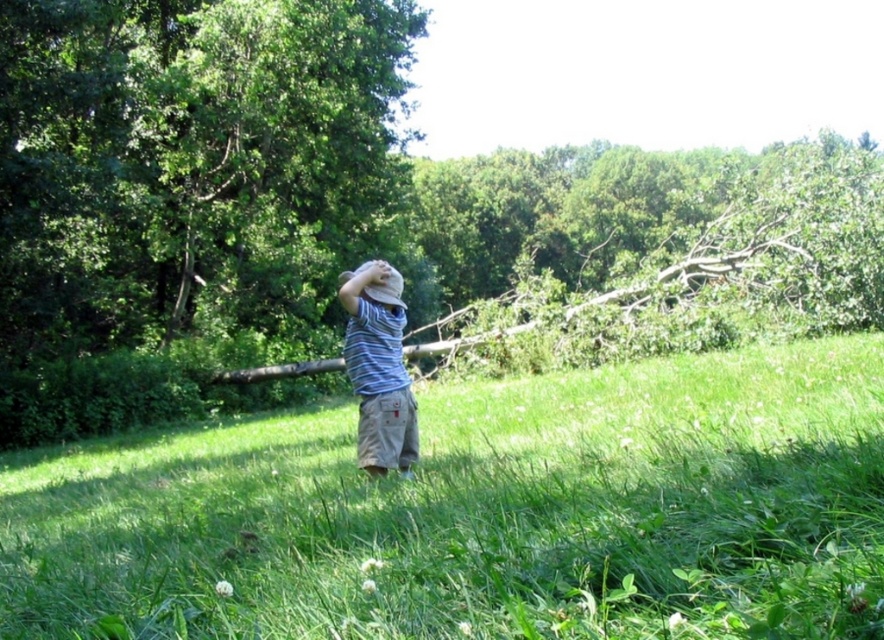
You are standing in the grassy field and want to place a picnic basket on the brown wood log at center. To do this, you need to walk towards the log. In which direction should you move relative to your current position?

The brown wood log at center is located at coordinates point (256, 196), so you should move towards that direction to place the picnic basket on it.

Consider the image. You are standing in the grassy field and want to place your backpack on the ground. You see the brown wood log at center and the striped cotton shirt at center. Which object is higher up and should you avoid placing your backpack underneath?

The brown wood log at center is positioned over the striped cotton shirt at center, so you should avoid placing your backpack underneath the brown wood log at center as it is higher up.